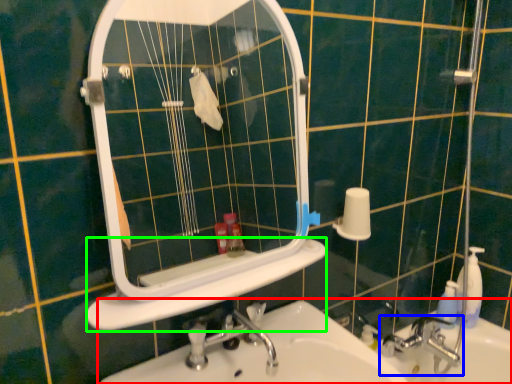
Question: Which is farther away from sink (highlighted by a red box)? tap (highlighted by a blue box) or ledge (highlighted by a green box)?

Choices:
 (A) tap
 (B) ledge

Answer: (A)